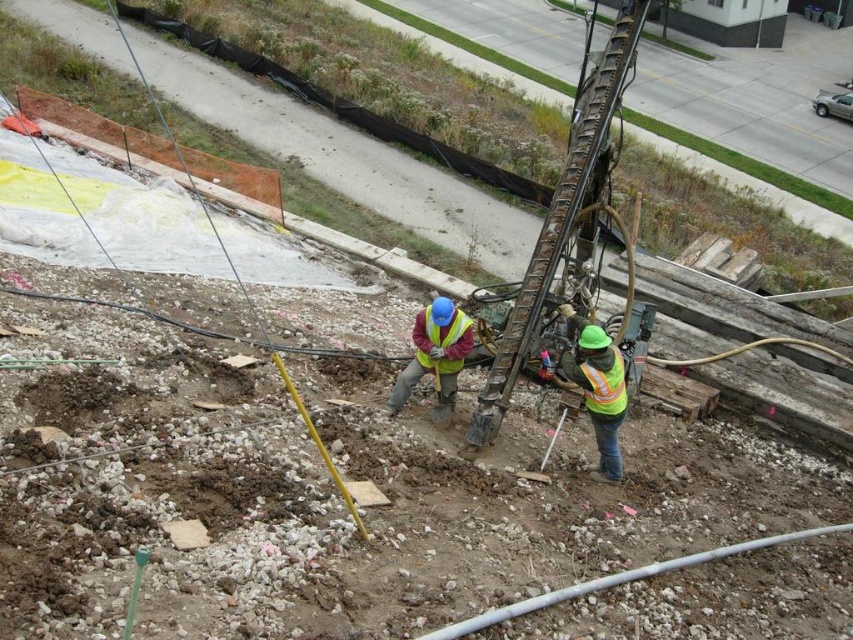
Question: Is reflective yellow-green vest at center bigger than reflective yellow vest at center?

Choices:
 (A) yes
 (B) no

Answer: (A)

Question: Which of the following is the farthest from the observer?

Choices:
 (A) (614, 397)
 (B) (425, 332)
 (C) (589, 342)

Answer: (B)

Question: Is reflective yellow-green vest at center positioned in front of reflective yellow safety vest at center?

Choices:
 (A) no
 (B) yes

Answer: (B)

Question: Does reflective yellow vest at center have a larger size compared to high-visibility reflective safety vest at lower right?

Choices:
 (A) yes
 (B) no

Answer: (A)

Question: Which object appears farthest from the camera in this image?

Choices:
 (A) high-visibility reflective safety vest at lower right
 (B) metallic drill rig at center
 (C) reflective yellow safety vest at center
 (D) reflective yellow-green vest at center

Answer: (B)

Question: Which object is the farthest from the reflective yellow safety vest at center?

Choices:
 (A) reflective yellow vest at center
 (B) metallic drill rig at center
 (C) reflective yellow-green vest at center
 (D) high-visibility reflective safety vest at lower right

Answer: (B)